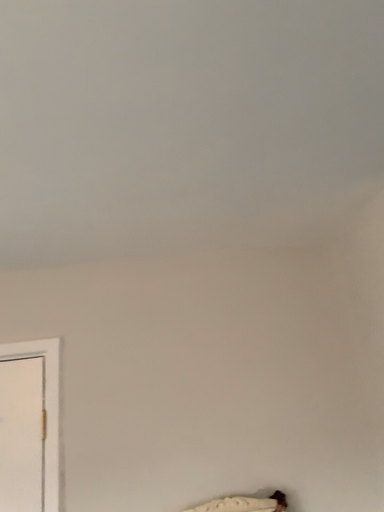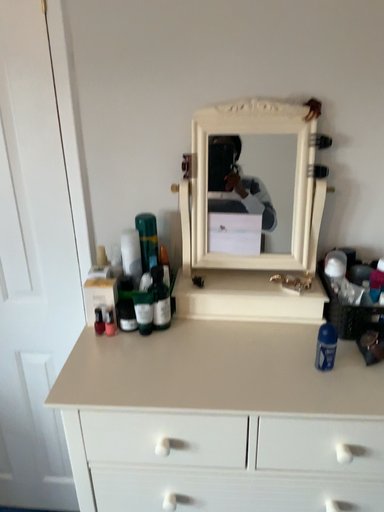
Question: How did the camera likely rotate when shooting the video?

Choices:
 (A) rotated right
 (B) rotated left

Answer: (B)